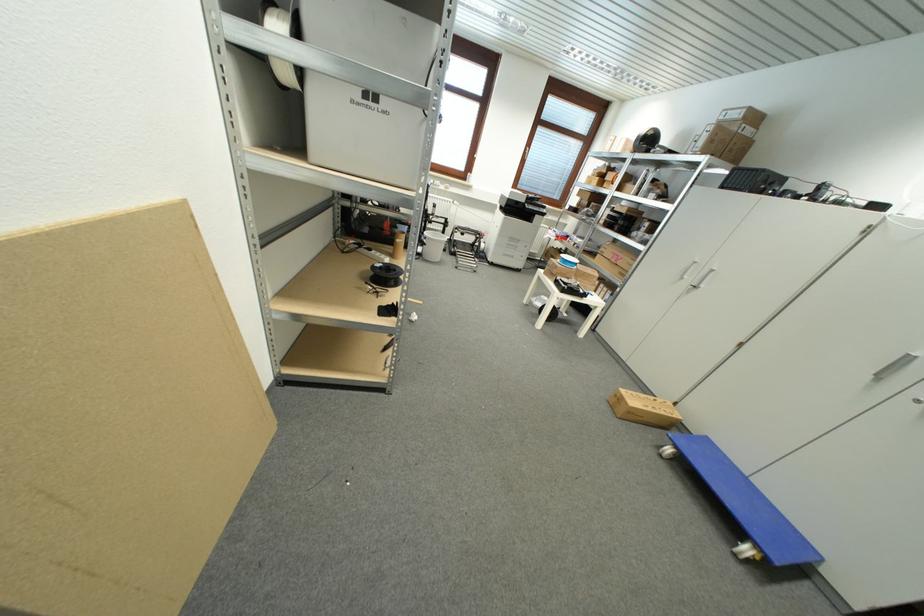
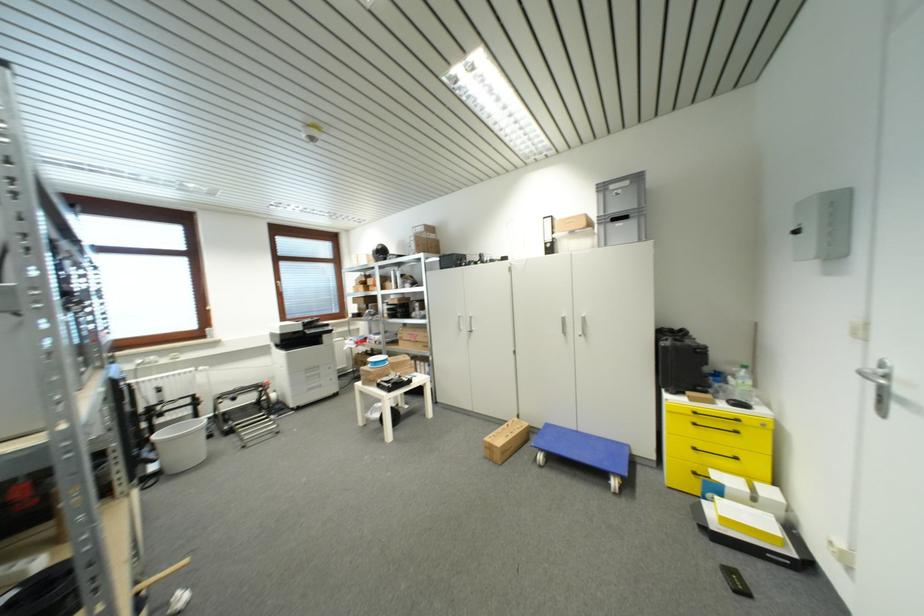
In the second image, find the point that corresponds to point 711,440 in the first image.

(552, 427)